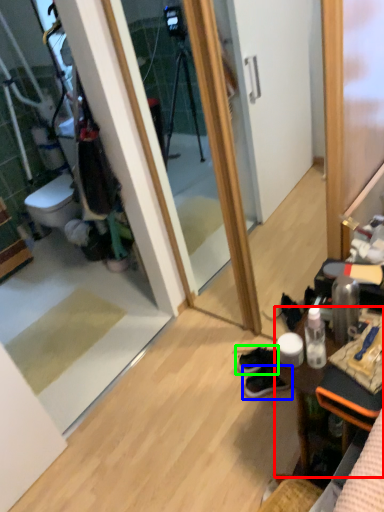
Question: Based on their relative distances, which object is nearer to desk (highlighted by a red box)? Choose from footwear (highlighted by a blue box) and footwear (highlighted by a green box).

Choices:
 (A) footwear
 (B) footwear

Answer: (A)